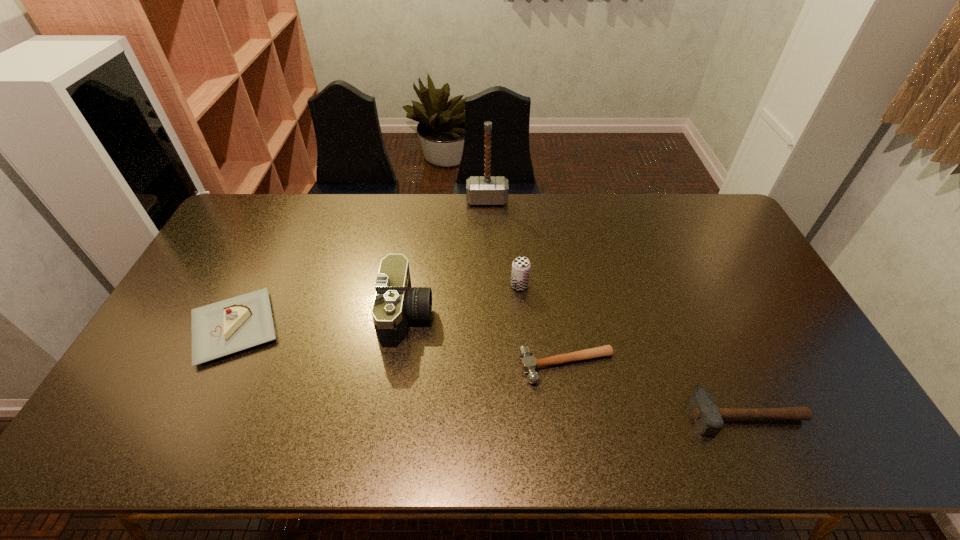
Find the location of `object located in the near right corner section of the desktop`. object located in the near right corner section of the desktop is located at coordinates (708, 417).

Find the location of a particular element. This screenshot has height=540, width=960. vacant space at the far edge is located at coordinates (560, 225).

Identify the location of free spot at the near edge of the desktop. The height and width of the screenshot is (540, 960). (630, 422).

In the image, there is a desktop. Find the location of `vacant space at the right edge`. vacant space at the right edge is located at coordinates (812, 362).

I want to click on unoccupied position between the tallest object and the second object from left to right, so click(447, 258).

Where is `free spot between the third shortest object and the farthest object`? This screenshot has height=540, width=960. free spot between the third shortest object and the farthest object is located at coordinates (361, 264).

Where is `free space that is in between the second shortest hammer and the fifth object from right to left`? This screenshot has height=540, width=960. free space that is in between the second shortest hammer and the fifth object from right to left is located at coordinates (577, 365).

The image size is (960, 540). Identify the location of vacant area that lies between the second tallest object and the farthest object. (447, 258).

At what (x,y) coordinates should I click in order to perform the action: click on vacant area between the leftmost object and the farthest object. Please return your answer as a coordinate pair (x, y). Looking at the image, I should click on (361, 264).

Find the location of a particular element. The image size is (960, 540). vacant area between the tallest hammer and the fourth shortest object is located at coordinates (503, 243).